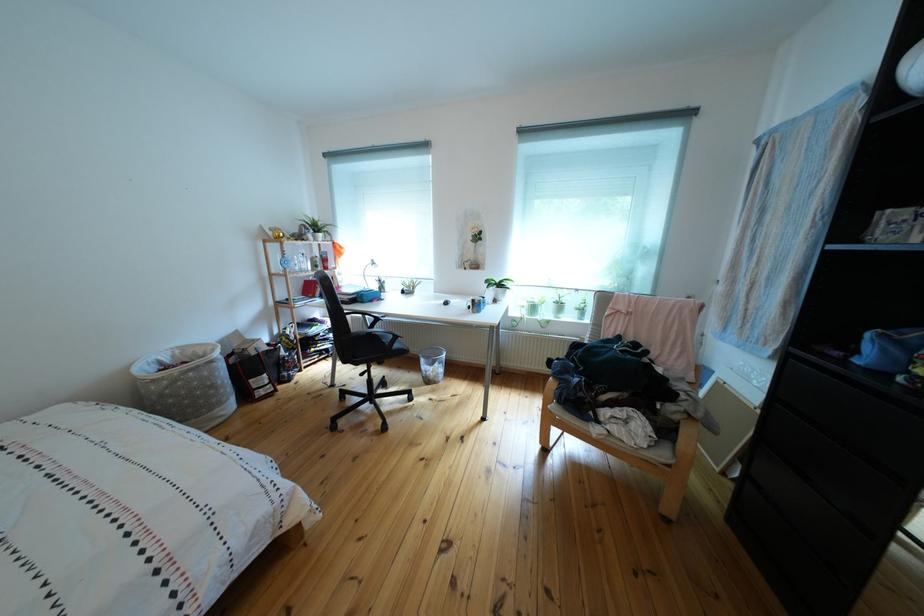
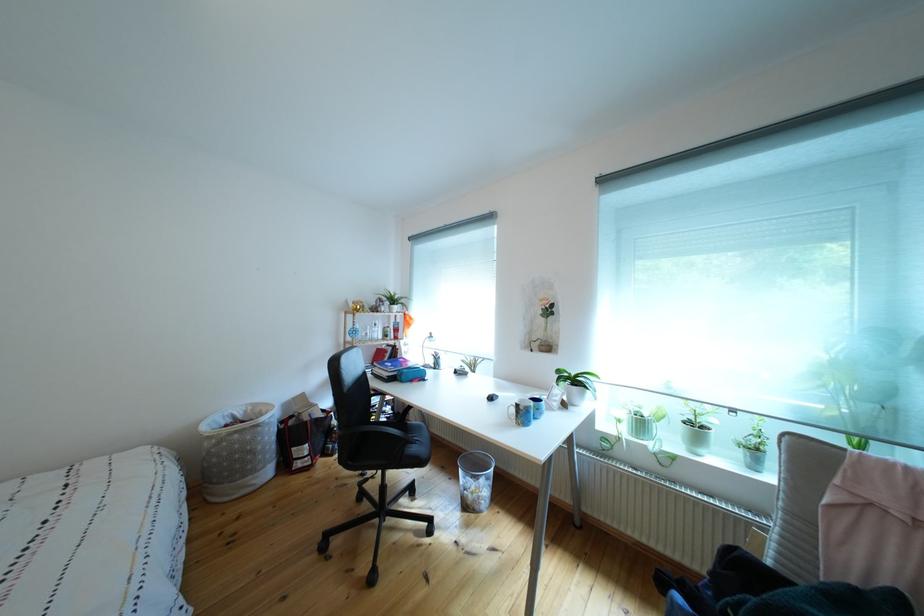
Find the pixel in the second image that matches the point at 484,306 in the first image.

(529, 411)